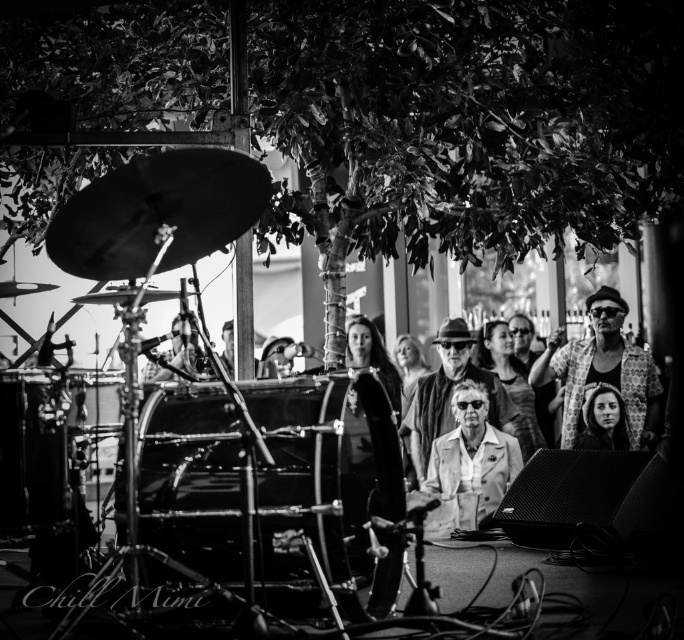
You are a photographer at the event and want to capture a photo of both the patterned fabric jacket at center and the matte beige coat at center. Which one should you focus on first to ensure both are in clear view?

You should focus on the patterned fabric jacket at center first because it is closer to the viewer than the matte beige coat at center, ensuring both will be in focus when starting with the closer object.

You are a photographer at the music event and want to capture both the patterned fabric jacket at center and the matte beige coat at center in the same frame. What is the minimum distance you need to move backward to ensure both are fully visible?

The patterned fabric jacket at center and matte beige coat at center are 10.40 feet apart from each other. To capture both in the same frame, you should move backward at least 10.40 feet to ensure the entire distance between them fits within your camera lens view.

Based on the photo, you are a photographer standing at the front of the stage. You want to take a photo of the shiny metallic drum at lower left and the light beige leather jacket at center. Which object should you focus on first to ensure both are in sharp focus?

The shiny metallic drum at lower left is closer to the viewer than the light beige leather jacket at center. To ensure both are in sharp focus, focus on the shiny metallic drum at lower left first, as it is closer, and the light beige leather jacket at center will fall within the depth of field.